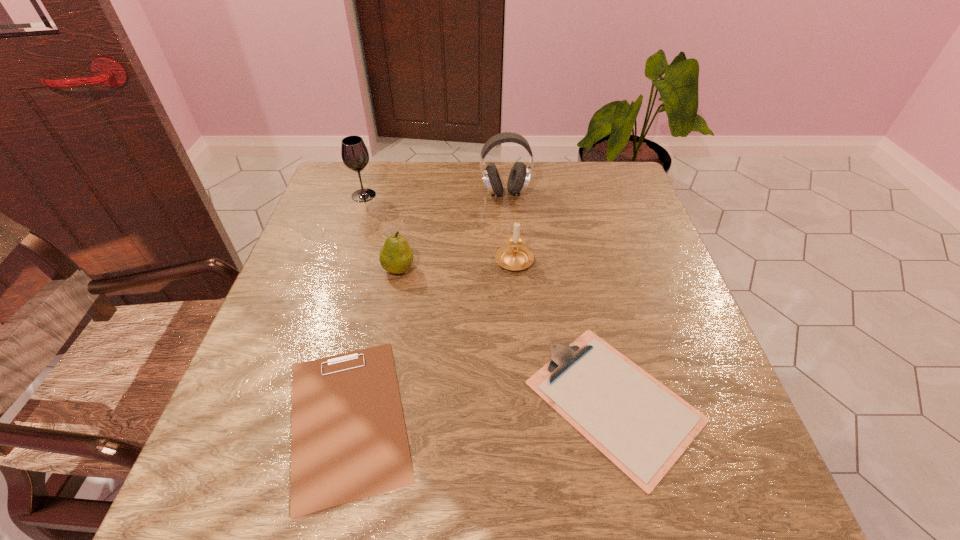
Where is `empty space between the pear and the headset`? empty space between the pear and the headset is located at coordinates (452, 231).

Where is `free point between the shortest object and the candle holder`? Image resolution: width=960 pixels, height=540 pixels. free point between the shortest object and the candle holder is located at coordinates (431, 339).

At what (x,y) coordinates should I click in order to perform the action: click on empty location between the headset and the wineglass. Please return your answer as a coordinate pair (x, y). Looking at the image, I should click on (435, 194).

This screenshot has height=540, width=960. Identify the location of empty space between the wineglass and the shortest object. (356, 307).

Identify the location of free space between the pear and the second shortest object. (506, 335).

Where is `empty space that is in between the wineglass and the taller clipboard`? The width and height of the screenshot is (960, 540). empty space that is in between the wineglass and the taller clipboard is located at coordinates click(489, 298).

Locate an element on the screen. The height and width of the screenshot is (540, 960). unoccupied position between the headset and the pear is located at coordinates (x=452, y=231).

You are a GUI agent. You are given a task and a screenshot of the screen. Output one action in this format:
    pyautogui.click(x=<x>, y=<y>)
    Task: Click on the empty space that is in between the right clipboard and the headset
    The height and width of the screenshot is (540, 960).
    Given the screenshot: What is the action you would take?
    pyautogui.click(x=560, y=297)

Where is `free area in between the left clipboard and the headset`? This screenshot has height=540, width=960. free area in between the left clipboard and the headset is located at coordinates (426, 306).

I want to click on free point between the shorter clipboard and the wineglass, so click(356, 307).